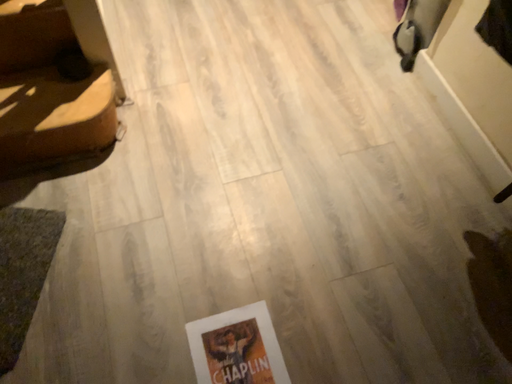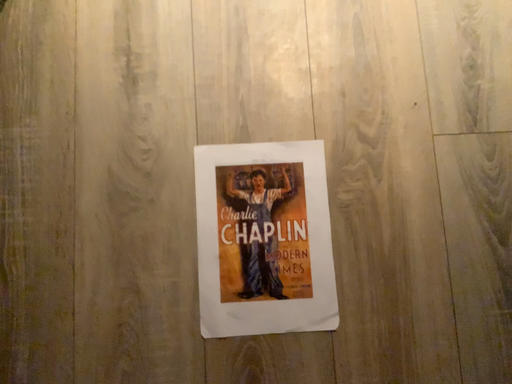
Question: How did the camera likely rotate when shooting the video?

Choices:
 (A) rotated upward
 (B) rotated downward

Answer: (B)